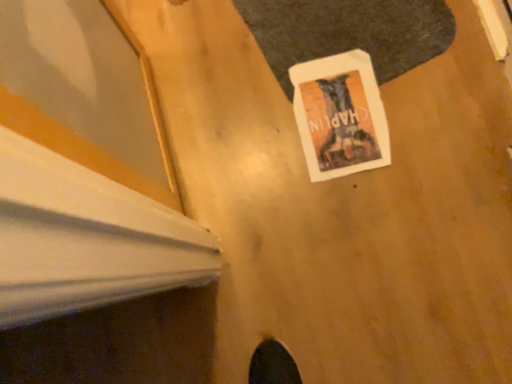
This screenshot has height=384, width=512. I want to click on free space in front of white paper at center, so click(384, 196).